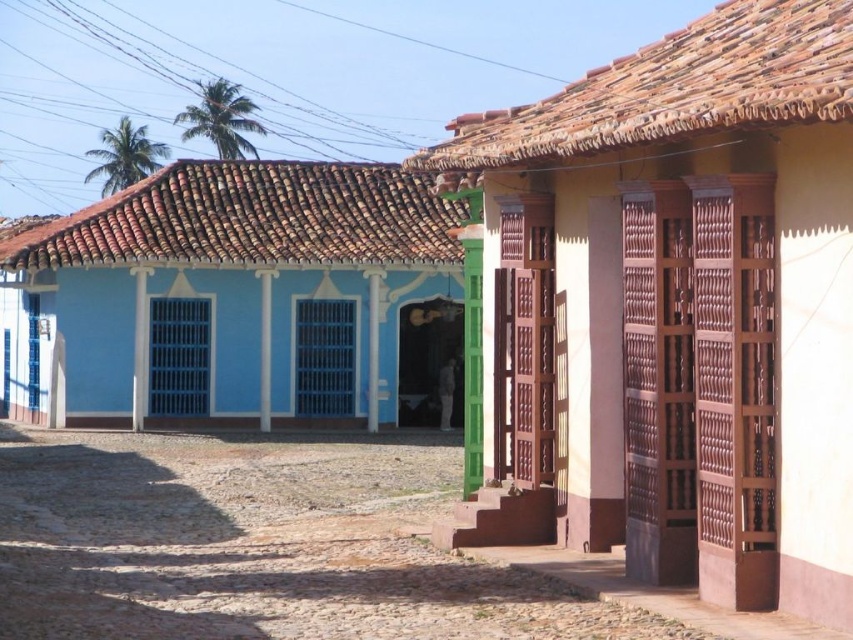
Is point (723, 236) in front of point (323, 248)?

Yes, point (723, 236) is closer to viewer.

Does matte brown wooden door at center appear over blue painted wood house at left?

Actually, matte brown wooden door at center is below blue painted wood house at left.

The width and height of the screenshot is (853, 640). What do you see at coordinates (686, 301) in the screenshot? I see `matte brown wooden door at center` at bounding box center [686, 301].

Where is `matte brown wooden door at center`? matte brown wooden door at center is located at coordinates (686, 301).